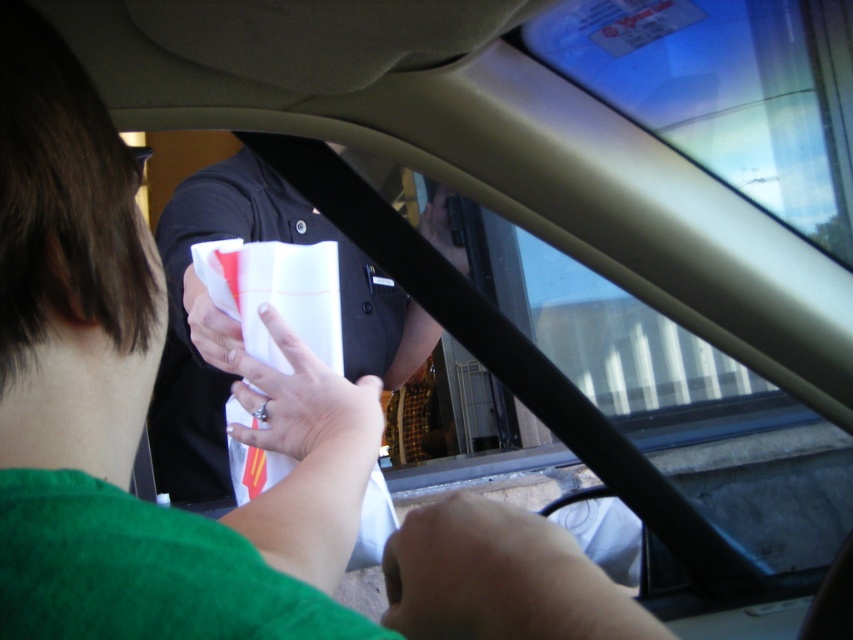
Consider the image. Does white matte paper at center appear on the left side of black plastic phone at upper center?

Answer: Indeed, white matte paper at center is positioned on the left side of black plastic phone at upper center.

Between point (260, 401) and point (445, 241), which one is positioned behind?

The point (445, 241) is more distant.

This screenshot has width=853, height=640. Identify the location of white matte paper at center. (306, 404).

Who is more forward, (498,547) or (189,285)?

Point (498,547) is more forward.

Is smooth skin hand at lower center further to the viewer compared to white paper at center?

No, smooth skin hand at lower center is closer to the viewer.

Does point (469, 499) come farther from viewer compared to point (193, 324)?

No, (469, 499) is in front of (193, 324).

This screenshot has height=640, width=853. I want to click on smooth skin hand at lower center, so click(x=500, y=579).

Consider the image. Who is taller, smooth skin hand at lower center or white matte paper at center?

white matte paper at center

Does smooth skin hand at lower center appear over white matte paper at center?

Incorrect, smooth skin hand at lower center is not positioned above white matte paper at center.

At what (x,y) coordinates should I click in order to perform the action: click on smooth skin hand at lower center. Please return your answer as a coordinate pair (x, y). This screenshot has width=853, height=640. Looking at the image, I should click on (500, 579).

This screenshot has width=853, height=640. In order to click on smooth skin hand at lower center in this screenshot , I will do `click(500, 579)`.